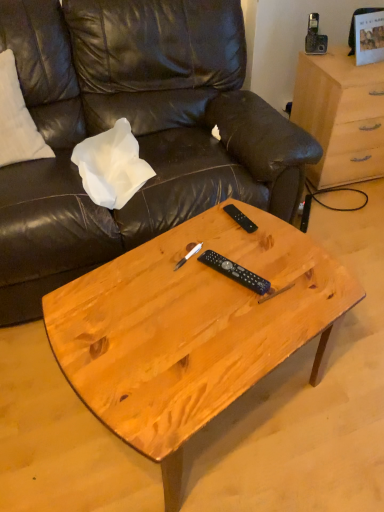
The height and width of the screenshot is (512, 384). In order to click on free location in front of black plastic remote at center, which is the 2th remote in front-to-back order in this screenshot , I will do `click(248, 257)`.